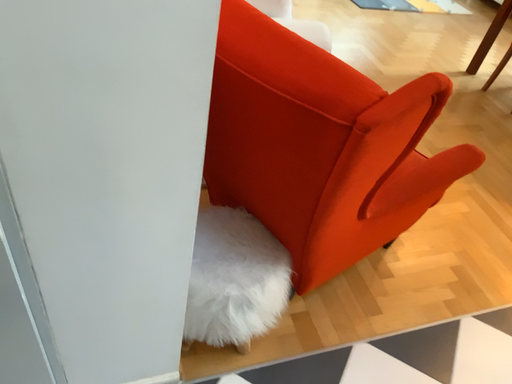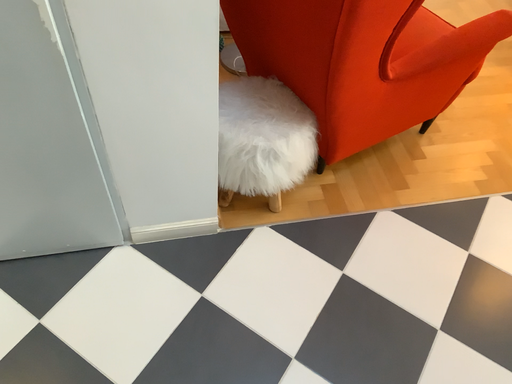
Question: Which way did the camera rotate in the video?

Choices:
 (A) rotated upward
 (B) rotated downward

Answer: (B)